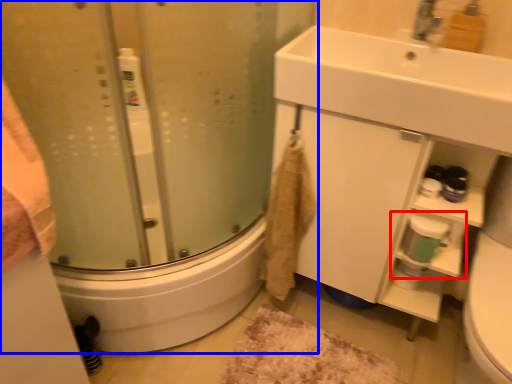
Question: Which object appears closest to the camera in this image, shelf (highlighted by a red box) or shower door (highlighted by a blue box)?

Choices:
 (A) shelf
 (B) shower door

Answer: (B)